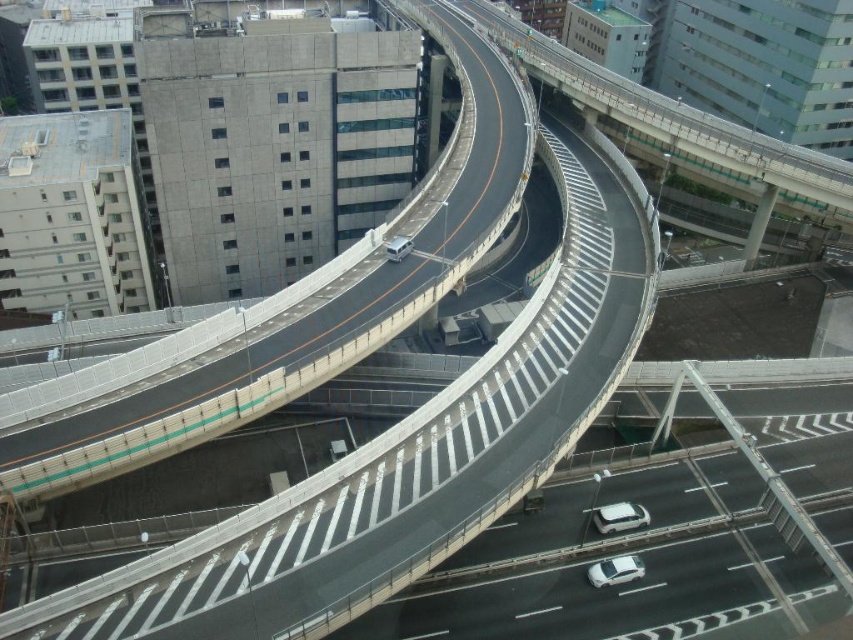
You are a delivery driver planning to drive your silver metallic van at center onto the smooth asphalt highway at center. Based on the scene, can your van fit on the highway without touching the sides?

The smooth asphalt highway at center is wider than the silver metallic van at center, so the van can fit on the highway without touching the sides.